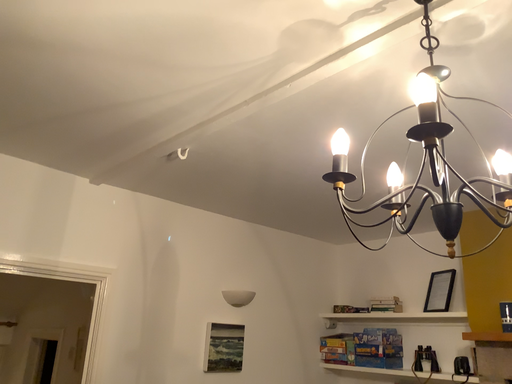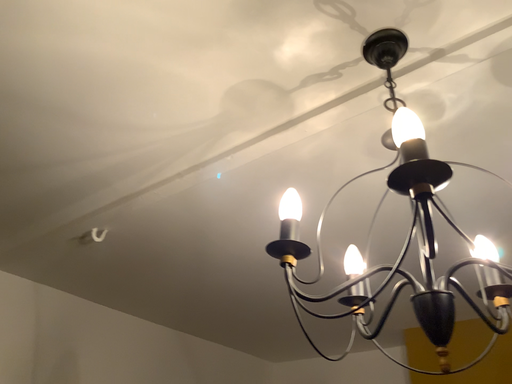
Question: How did the camera likely rotate when shooting the video?

Choices:
 (A) rotated downward
 (B) rotated upward

Answer: (B)